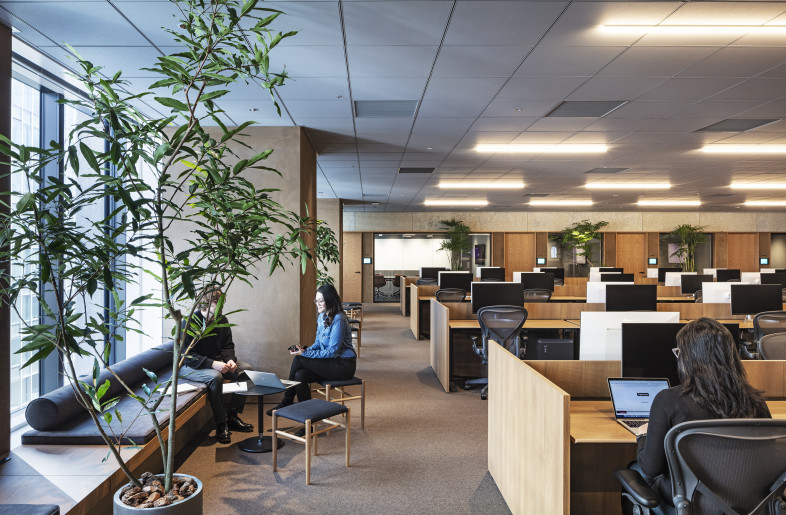
At what (x,y) coordinates should I click in order to perform the action: click on chair. Please return your answer as a coordinate pair (x, y). Image resolution: width=786 pixels, height=515 pixels. Looking at the image, I should click on (689, 465), (766, 337), (513, 321), (548, 294), (458, 291), (427, 281), (399, 281), (379, 278), (700, 298).